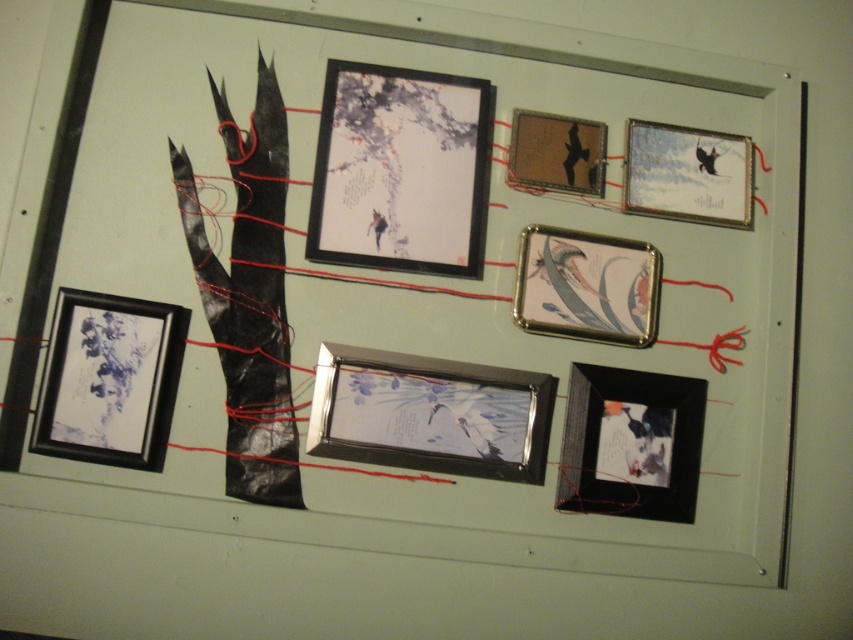
Question: Among these points, which one is farthest from the camera?

Choices:
 (A) (659, 128)
 (B) (412, 440)
 (C) (566, 436)
 (D) (328, 216)

Answer: (A)

Question: Which point is closer to the camera taking this photo?

Choices:
 (A) (354, 109)
 (B) (549, 186)
 (C) (746, 164)
 (D) (624, 376)

Answer: (D)

Question: Which of the following is the farthest from the observer?

Choices:
 (A) metallic silver frame at center
 (B) metallic gold picture frame at upper center

Answer: (B)

Question: Does matte black frame at upper center have a smaller size compared to metallic silver frame at center?

Choices:
 (A) yes
 (B) no

Answer: (B)

Question: Is matte black frame at upper center smaller than matte black picture frame at lower left?

Choices:
 (A) yes
 (B) no

Answer: (B)

Question: Does matte black picture frame at lower left have a larger size compared to metallic gold picture frame at upper center?

Choices:
 (A) yes
 (B) no

Answer: (A)